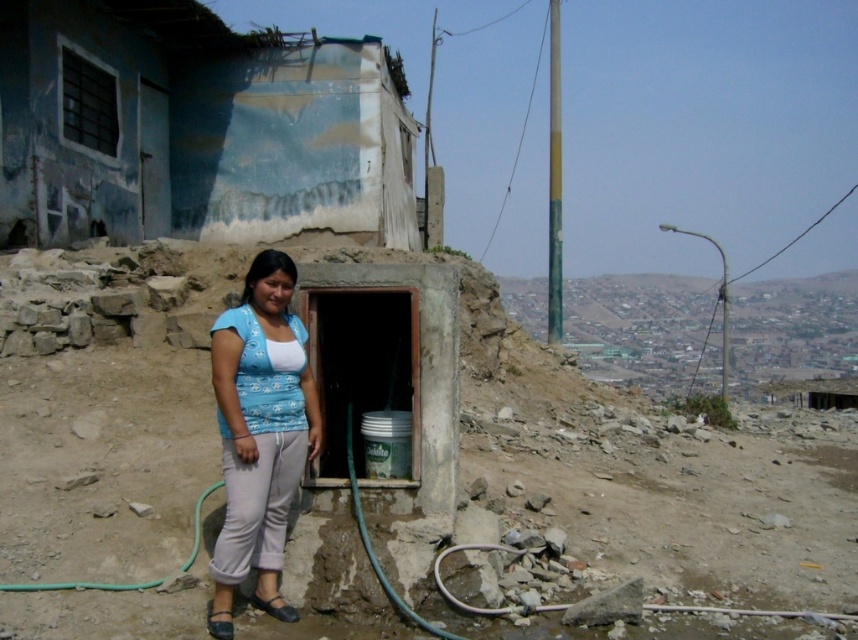
You are a painter who needs to touch up the blue painted wall at upper left and the blue cotton shirt at center. Which object is closer to you so you can start working on it first?

The blue painted wall at upper left is closer to you than the blue cotton shirt at center, so you can start working on the blue painted wall at upper left first.